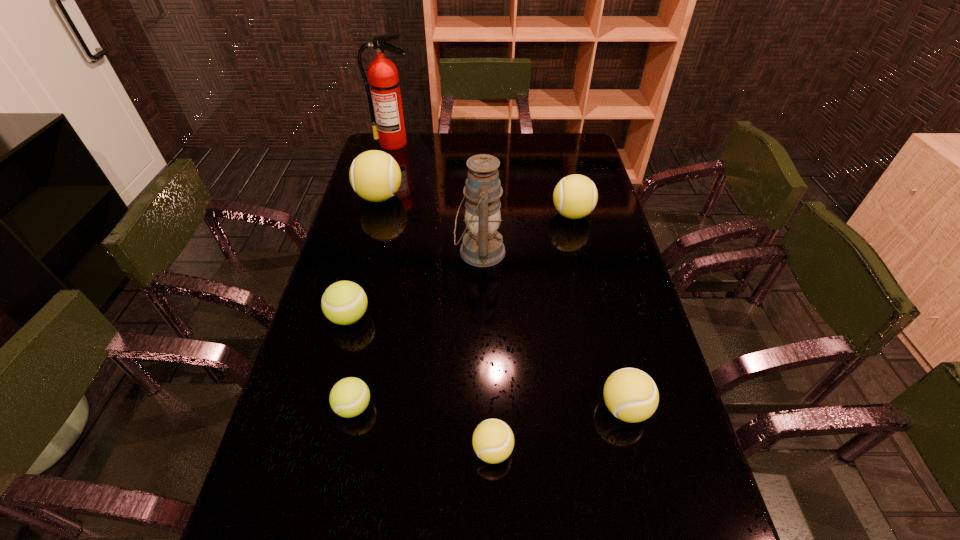
Find the location of a particular element. Image resolution: width=960 pixels, height=540 pixels. object that is the sixth closest to the third biggest yellow tennis ball is located at coordinates (375, 176).

Locate an element on the screen. object identified as the fifth closest to the fire extinguisher is located at coordinates (349, 397).

Point out which tennis ball is positioned as the third nearest to the third smallest yellow tennis ball. Please provide its 2D coordinates. Your answer should be formatted as a tuple, i.e. [(x, y)], where the tuple contains the x and y coordinates of a point satisfying the conditions above.

[(344, 302)]

Find the location of a particular element. The height and width of the screenshot is (540, 960). the fourth closest tennis ball to the fire extinguisher is located at coordinates (349, 397).

Identify which yellow tennis ball is the fourth nearest to the tallest object. Please provide its 2D coordinates. Your answer should be formatted as a tuple, i.e. [(x, y)], where the tuple contains the x and y coordinates of a point satisfying the conditions above.

[(493, 440)]

What are the coordinates of `yellow tennis ball that stands as the fourth closest to the fourth nearest object` in the screenshot? It's located at (575, 196).

Where is `vacant point that satisfies the following two spatial constraints: 1. on the side of the second smallest yellow tennis ball near the handle; 2. on the left side of the tallest object`? The image size is (960, 540). vacant point that satisfies the following two spatial constraints: 1. on the side of the second smallest yellow tennis ball near the handle; 2. on the left side of the tallest object is located at coordinates (324, 408).

Where is `vacant space that satisfies the following two spatial constraints: 1. on the front side of the third biggest yellow tennis ball; 2. on the left side of the fourth nearest object`? The height and width of the screenshot is (540, 960). vacant space that satisfies the following two spatial constraints: 1. on the front side of the third biggest yellow tennis ball; 2. on the left side of the fourth nearest object is located at coordinates (325, 408).

Identify the location of free space that satisfies the following two spatial constraints: 1. on the side of the fifth shortest object near the handle; 2. on the left side of the farthest object. (375, 214).